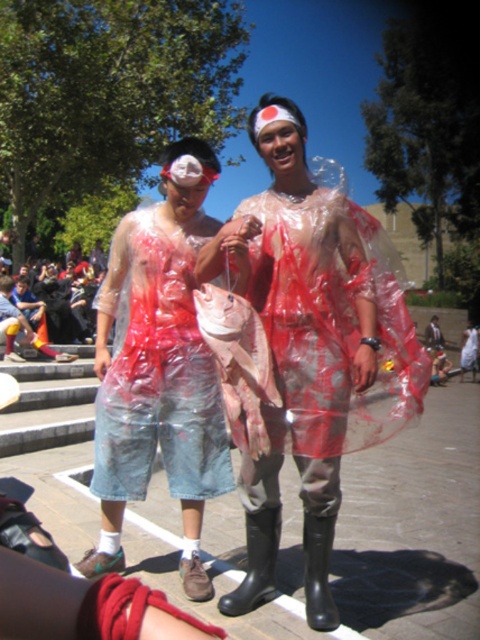
In the scene shown: You are standing in front of the scene described. You want to take a photo of the transparent plastic fish at center without getting too close. If your camera can focus clearly on objects up to 3 meters away, will you be able to take a clear photo from your current position?

The transparent plastic fish at center is 2.72 meters away from the viewer. Since your camera can focus up to 3 meters, you can take a clear photo without moving closer.

You are organizing a costume party and need to determine which object from the scene is more suitable for a child to carry safely. Considering the size difference mentioned, which object between the transparent plastic fish at center and the matte plastic bag at center would be easier for a child to handle?

The transparent plastic fish at center is smaller than the matte plastic bag at center, so the transparent plastic fish at center would be easier for a child to handle due to its smaller size.